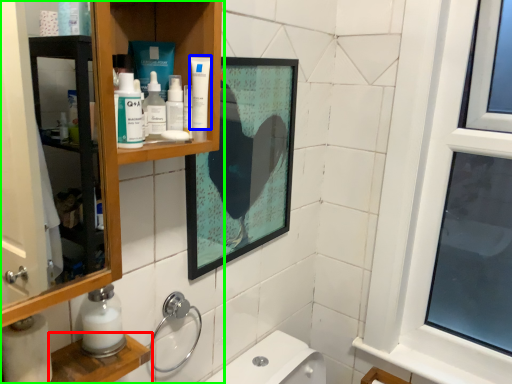
Question: Considering the real-world distances, which object is closest to cabinet (highlighted by a red box)? toothpaste (highlighted by a blue box) or bathroom cabinet (highlighted by a green box).

Choices:
 (A) toothpaste
 (B) bathroom cabinet

Answer: (B)